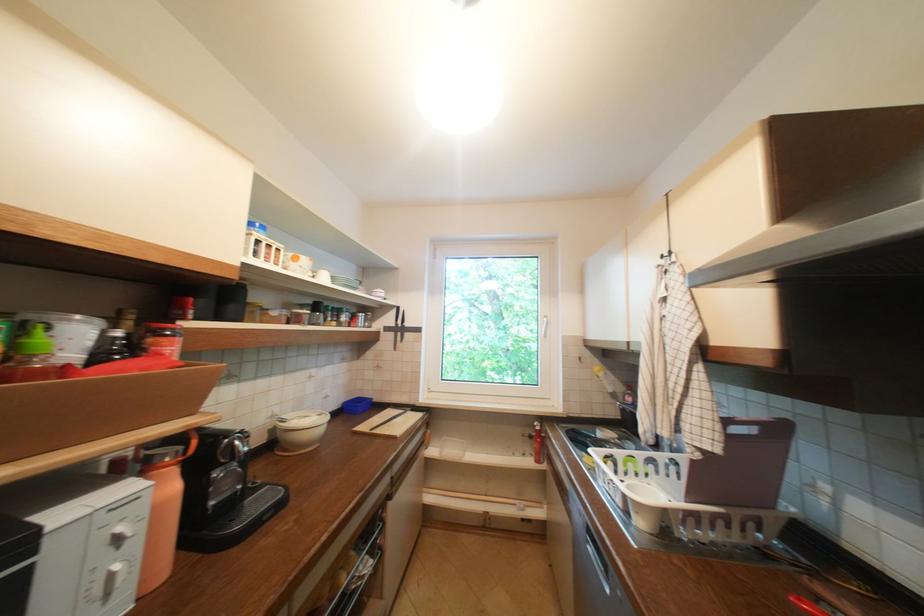
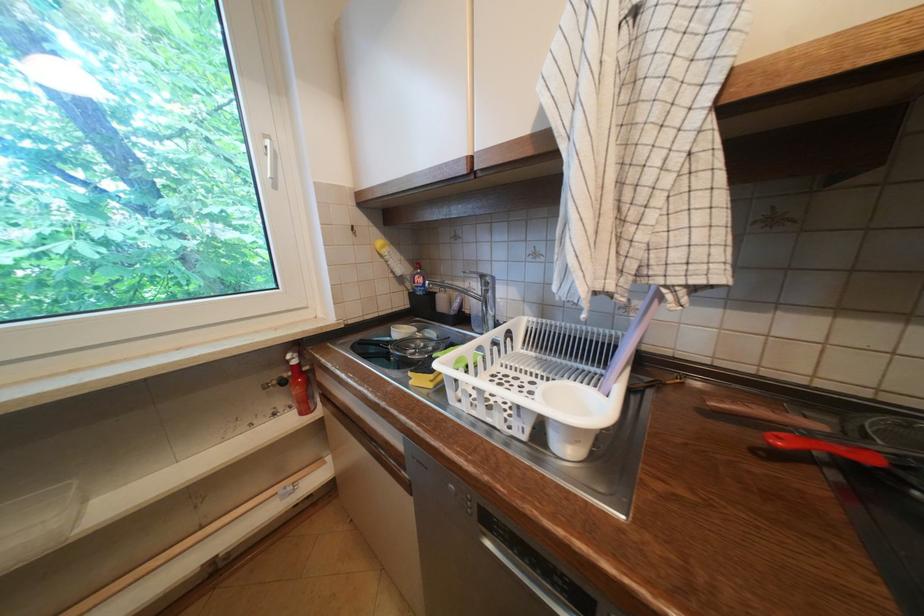
Locate, in the second image, the point that corresponds to point 646,514 in the first image.

(586, 443)